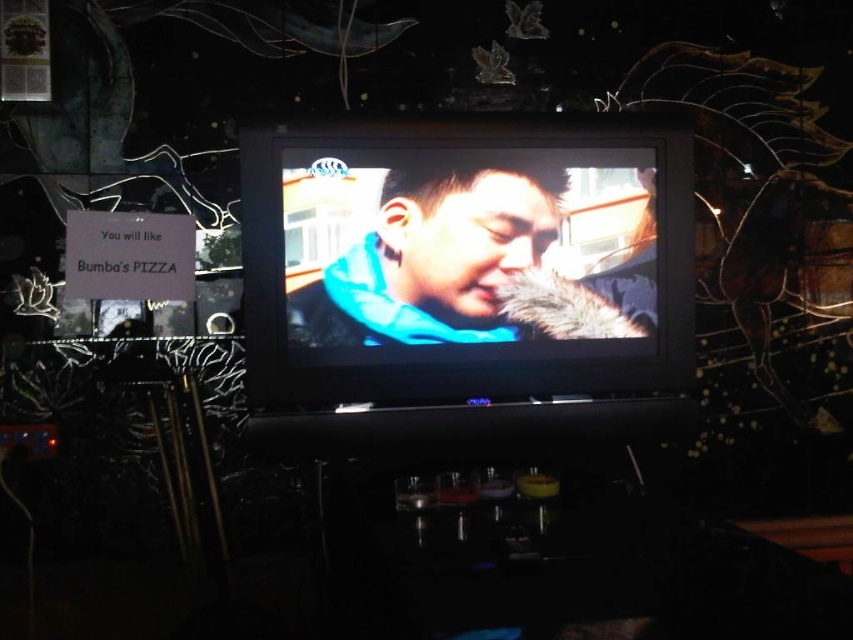
Does matte black tv at center come behind blue matte scarf at center?

No, matte black tv at center is closer to the viewer.

Who is higher up, matte black tv at center or blue matte scarf at center?

matte black tv at center

Locate an element on the screen. The image size is (853, 640). matte black tv at center is located at coordinates (460, 259).